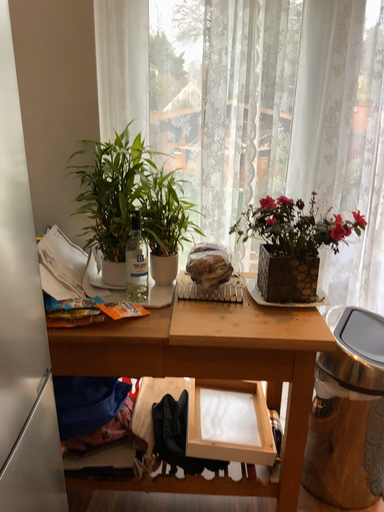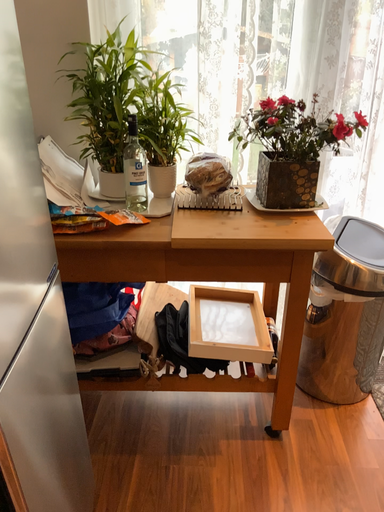
Question: How did the camera likely rotate when shooting the video?

Choices:
 (A) rotated upward
 (B) rotated downward

Answer: (B)